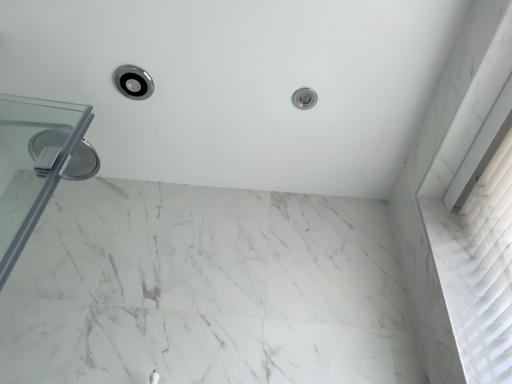
Question: Is white marble bath at upper center positioned before satin nickel showerhead at upper center, which appears as the 2th shower when viewed from the left?

Choices:
 (A) yes
 (B) no

Answer: (A)

Question: Is satin nickel showerhead at upper center, the 1th shower positioned from the right, inside white marble bath at upper center?

Choices:
 (A) no
 (B) yes

Answer: (B)

Question: Is white marble bath at upper center oriented towards satin nickel showerhead at upper center, the 1th shower positioned from the right?

Choices:
 (A) yes
 (B) no

Answer: (B)

Question: Does white marble bath at upper center have a greater width compared to satin nickel showerhead at upper center, the 1th shower positioned from the right?

Choices:
 (A) no
 (B) yes

Answer: (B)

Question: Can you confirm if white marble bath at upper center is thinner than satin nickel showerhead at upper center, which appears as the 2th shower when viewed from the left?

Choices:
 (A) yes
 (B) no

Answer: (B)

Question: Is point (121, 77) positioned closer to the camera than point (310, 99)?

Choices:
 (A) farther
 (B) closer

Answer: (B)

Question: From a real-world perspective, is polished chrome showerhead at upper left, the second shower when ordered from right to left, positioned above or below satin nickel showerhead at upper center, which appears as the 2th shower when viewed from the left?

Choices:
 (A) above
 (B) below

Answer: (B)

Question: Is polished chrome showerhead at upper left, the second shower when ordered from right to left, situated inside satin nickel showerhead at upper center, which appears as the 2th shower when viewed from the left, or outside?

Choices:
 (A) inside
 (B) outside

Answer: (B)

Question: From the image's perspective, is polished chrome showerhead at upper left, the second shower when ordered from right to left, positioned above or below satin nickel showerhead at upper center, the 1th shower positioned from the right?

Choices:
 (A) above
 (B) below

Answer: (A)

Question: Considering their positions, is transparent glass door at left located in front of or behind white marble bath at upper center?

Choices:
 (A) behind
 (B) front

Answer: (B)

Question: From the image's perspective, is transparent glass door at left positioned above or below white marble bath at upper center?

Choices:
 (A) above
 (B) below

Answer: (B)

Question: From a real-world perspective, is transparent glass door at left positioned above or below white marble bath at upper center?

Choices:
 (A) above
 (B) below

Answer: (B)

Question: Would you say transparent glass door at left is to the left or to the right of white marble bath at upper center in the picture?

Choices:
 (A) left
 (B) right

Answer: (A)

Question: Considering their positions, is polished chrome showerhead at upper left, which is the first shower from left to right, located in front of or behind white marble bath at upper center?

Choices:
 (A) front
 (B) behind

Answer: (B)

Question: From a real-world perspective, is polished chrome showerhead at upper left, the second shower when ordered from right to left, positioned above or below white marble bath at upper center?

Choices:
 (A) above
 (B) below

Answer: (B)